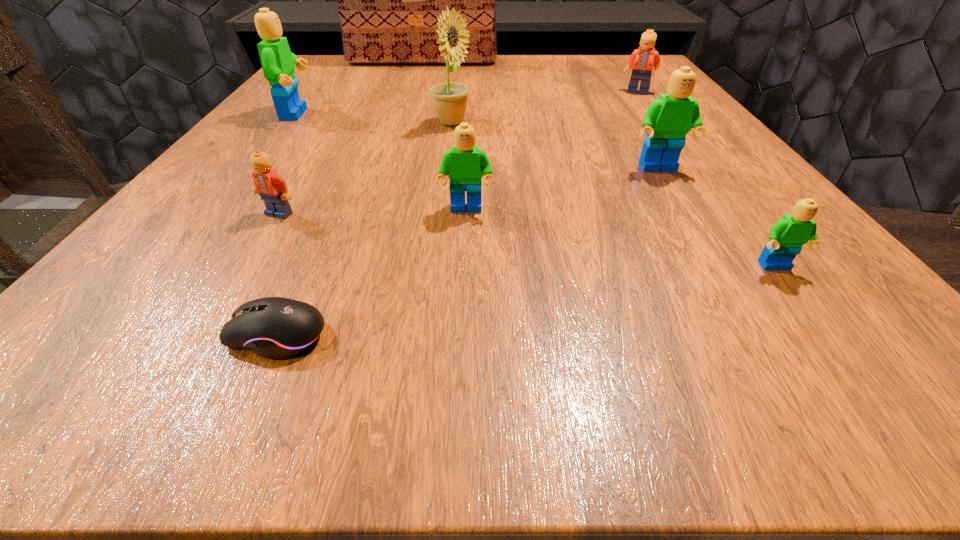
In the image, there is a desktop. Where is `free region at the far edge`? The height and width of the screenshot is (540, 960). free region at the far edge is located at coordinates (397, 77).

The image size is (960, 540). In the image, there is a desktop. In order to click on vacant space at the near edge in this screenshot , I will do `click(619, 329)`.

The image size is (960, 540). I want to click on vacant area at the left edge of the desktop, so click(273, 163).

Locate an element on the screen. The width and height of the screenshot is (960, 540). vacant area at the right edge of the desktop is located at coordinates (787, 286).

Where is `free space at the far left corner`? free space at the far left corner is located at coordinates (343, 76).

The width and height of the screenshot is (960, 540). In order to click on free location at the far right corner of the desktop in this screenshot , I will do `click(594, 69)`.

This screenshot has width=960, height=540. In the image, there is a desktop. Identify the location of free region at the near right corner. [881, 350].

Where is `empty space between the tallest Lego and the tallest object`? empty space between the tallest Lego and the tallest object is located at coordinates (359, 89).

Where is `unoccupied area between the leftmost Lego and the sixth shortest object`? Image resolution: width=960 pixels, height=540 pixels. unoccupied area between the leftmost Lego and the sixth shortest object is located at coordinates (478, 141).

Where is `vacant area that lies between the second green Lego from left to right and the smaller orange Lego`? Image resolution: width=960 pixels, height=540 pixels. vacant area that lies between the second green Lego from left to right and the smaller orange Lego is located at coordinates (372, 212).